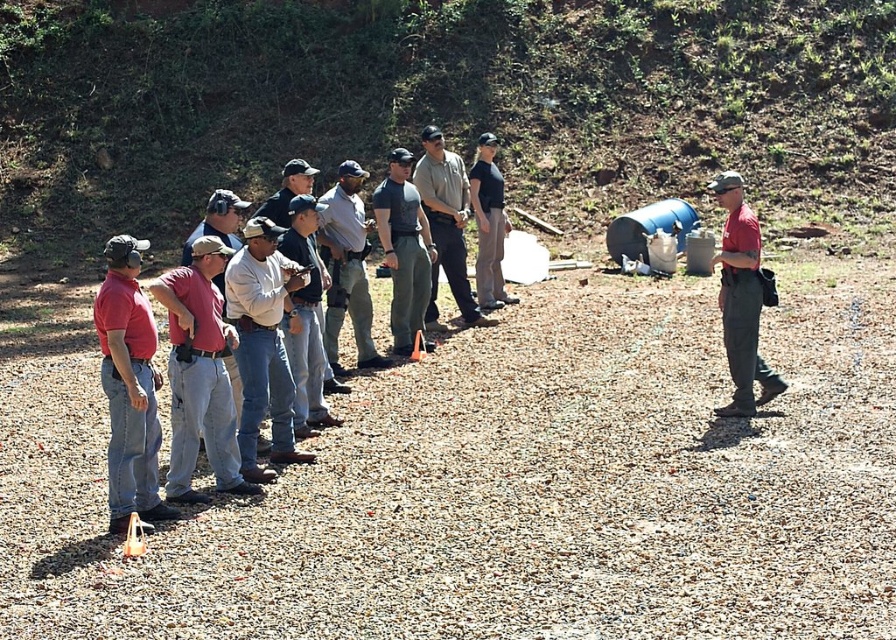
You are a photographer positioned at the back of the group. You want to take a photo that includes both the matte red shirt at right and the light brown leather jacket at center. Which object should you focus on first to ensure both are in frame?

The matte red shirt at right is taller than the light brown leather jacket at center, so you should focus on the matte red shirt at right first to ensure both are in frame.

Looking at this image, you are standing at the center of the group and see the point marked as point (502, 483). What is located at that specific point?

The point (502, 483) is marked as brown gravel at center.

You are organizing a photo shoot and need to ensure that all clothing items are appropriately sized for the models. Given the scene described, can you confirm if the matte red shirt at right is larger than the light brown leather jacket at center?

The matte red shirt at right is bigger than the light brown leather jacket at center, so yes, the matte red shirt at right is larger than the light brown leather jacket at center.